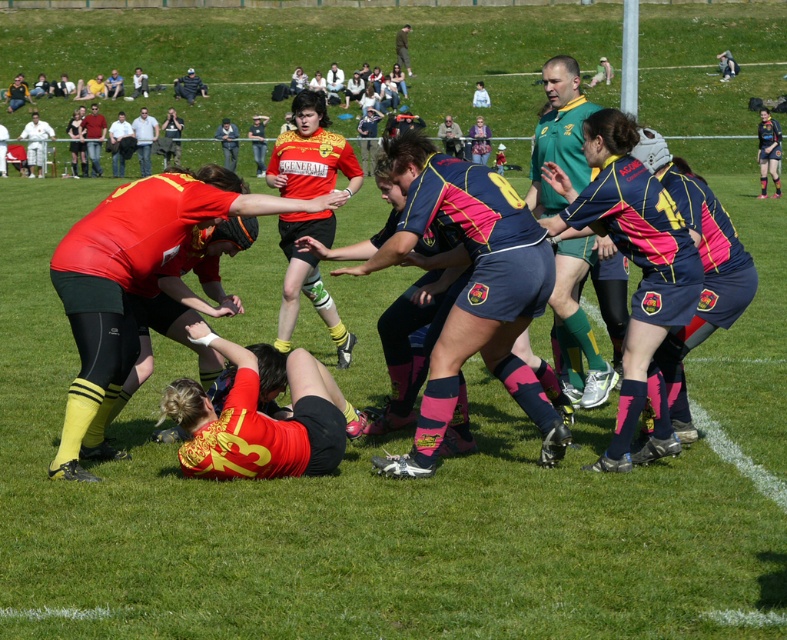
Does matte yellow jersey at center appear on the right side of green jersey at upper center?

In fact, matte yellow jersey at center is to the left of green jersey at upper center.

Where is `matte yellow jersey at center`? This screenshot has width=787, height=640. matte yellow jersey at center is located at coordinates (257, 419).

Is green jersey at upper center above matte black shorts at upper right?

No, green jersey at upper center is not above matte black shorts at upper right.

Which of these two, green jersey at upper center or matte black shorts at upper right, stands taller?

With more height is green jersey at upper center.

Which is behind, point (542, 147) or point (771, 138)?

The point (771, 138) is behind.

Identify the location of green jersey at upper center. 558,134.

The width and height of the screenshot is (787, 640). What do you see at coordinates (257, 419) in the screenshot?
I see `matte yellow jersey at center` at bounding box center [257, 419].

Based on the photo, can you confirm if matte yellow jersey at center is positioned above matte black shorts at upper right?

No.

Is point (320, 454) positioned in front of point (771, 164)?

Yes, it is in front of point (771, 164).

The width and height of the screenshot is (787, 640). In order to click on matte yellow jersey at center in this screenshot , I will do `click(257, 419)`.